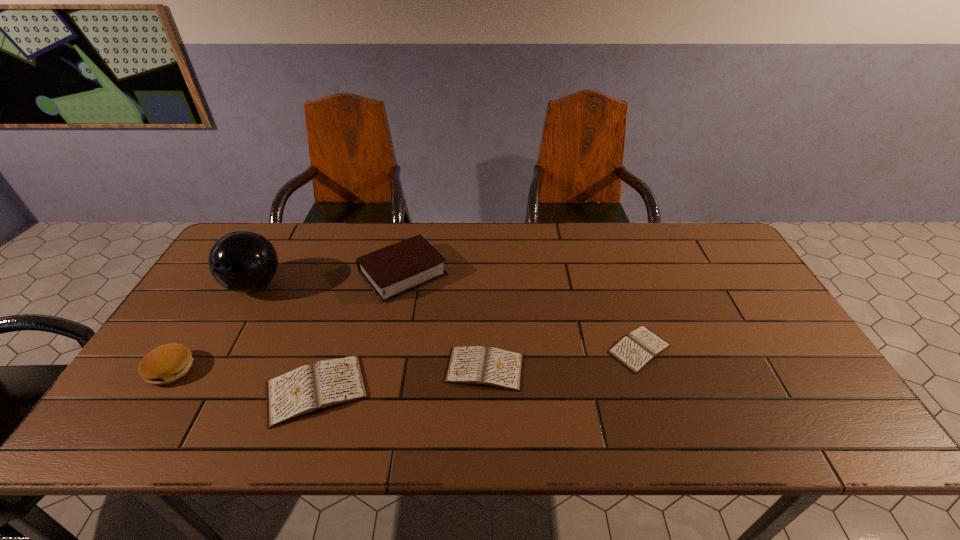
Locate an element on the screen. free location located on the right of the second tallest diary is located at coordinates (665, 369).

Identify the location of vacant point located 0.310m on the right of the rightmost diary. (792, 349).

Locate an element on the screen. The width and height of the screenshot is (960, 540). vacant space located on the back of the Bible is located at coordinates (411, 236).

Locate an element on the screen. The height and width of the screenshot is (540, 960). vacant space situated on the side of the bowling ball with the finger holes is located at coordinates (225, 338).

Image resolution: width=960 pixels, height=540 pixels. I want to click on vacant area situated 0.400m on the back of the patty, so click(244, 254).

At what (x,y) coordinates should I click in order to perform the action: click on Bible positioned at the far edge. Please return your answer as a coordinate pair (x, y). Looking at the image, I should click on (391, 271).

Image resolution: width=960 pixels, height=540 pixels. Find the location of `bowling ball positioned at the far edge`. bowling ball positioned at the far edge is located at coordinates (242, 261).

Image resolution: width=960 pixels, height=540 pixels. I want to click on patty at the near edge, so click(x=165, y=364).

At what (x,y) coordinates should I click in order to perform the action: click on bowling ball located at the left edge. Please return your answer as a coordinate pair (x, y). Looking at the image, I should click on (242, 261).

Identify the location of patty at the left edge. Image resolution: width=960 pixels, height=540 pixels. (165, 364).